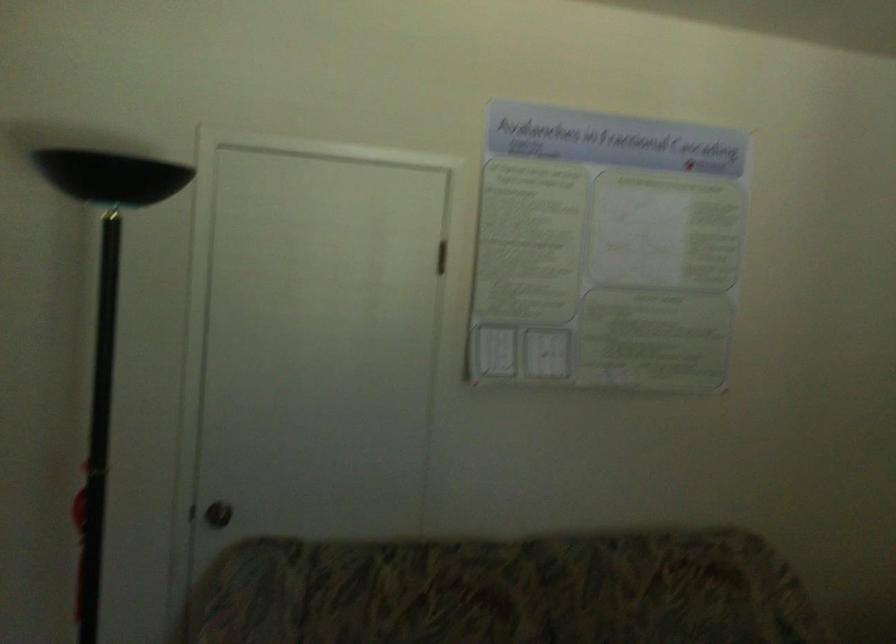
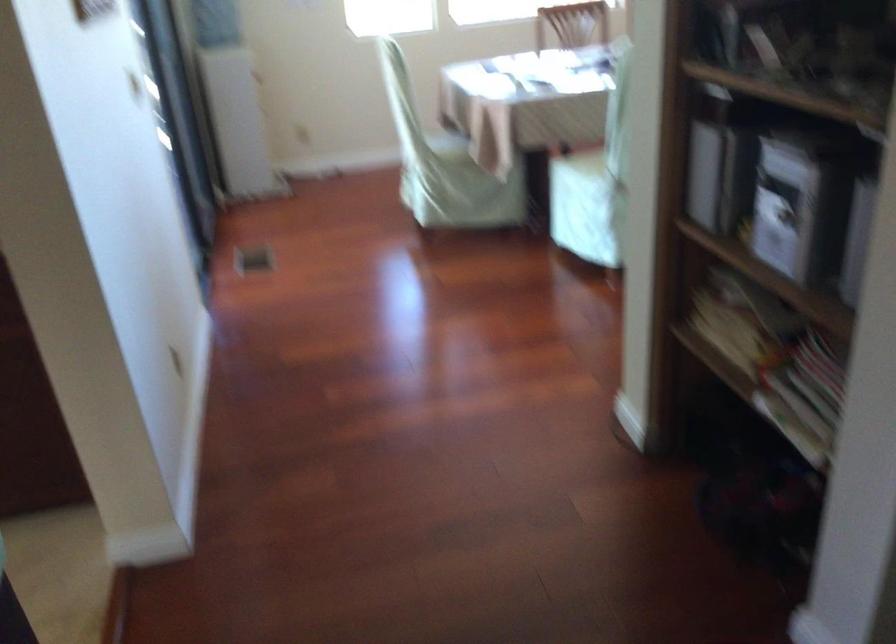
Which direction would the cameraman need to move to produce the second image?

The cameraman moved toward left, forward.